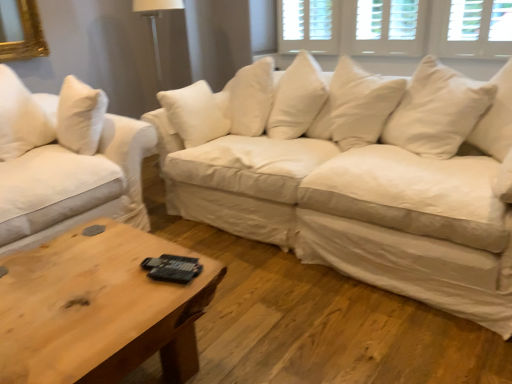
Question: Does white cotton couch at center, which is counted as the 1th studio couch, starting from the right, have a lesser height compared to white wood window at upper center, the second window when ordered from right to left?

Choices:
 (A) yes
 (B) no

Answer: (B)

Question: Is white cotton couch at center, which is counted as the 1th studio couch, starting from the right, outside white wood window at upper center, the second window when ordered from right to left?

Choices:
 (A) yes
 (B) no

Answer: (A)

Question: Is white cotton couch at center, the 2th studio couch when ordered from left to right, positioned with its back to white wood window at upper center, the first window from the left?

Choices:
 (A) yes
 (B) no

Answer: (B)

Question: From the image's perspective, is white cotton couch at center, which is counted as the 1th studio couch, starting from the right, under white wood window at upper center, the second window when ordered from right to left?

Choices:
 (A) yes
 (B) no

Answer: (A)

Question: Is the depth of white cotton couch at center, which is counted as the 1th studio couch, starting from the right, greater than that of white wood window at upper center, the first window from the left?

Choices:
 (A) yes
 (B) no

Answer: (B)

Question: Choose the correct answer: Is white wood blinds at upper center, the 1th window in the right-to-left sequence, inside white cotton couch at left, which is counted as the 2th studio couch, starting from the right, or outside it?

Choices:
 (A) outside
 (B) inside

Answer: (A)

Question: Considering the positions of white wood blinds at upper center, the 1th window in the right-to-left sequence, and white cotton couch at left, which is counted as the 2th studio couch, starting from the right, in the image, is white wood blinds at upper center, the 1th window in the right-to-left sequence, taller or shorter than white cotton couch at left, which is counted as the 2th studio couch, starting from the right,?

Choices:
 (A) tall
 (B) short

Answer: (B)

Question: Is white wood blinds at upper center, which ranks as the second window in left-to-right order, to the left or to the right of white cotton couch at left, the 1th studio couch in the left-to-right sequence, in the image?

Choices:
 (A) right
 (B) left

Answer: (A)

Question: From the image's perspective, relative to white cotton couch at left, which is counted as the 2th studio couch, starting from the right, is white wood blinds at upper center, which ranks as the second window in left-to-right order, above or below?

Choices:
 (A) below
 (B) above

Answer: (B)

Question: Do you think white cotton couch at left, which is counted as the 2th studio couch, starting from the right, is within white wood window at upper center, the first window from the left, or outside of it?

Choices:
 (A) inside
 (B) outside

Answer: (B)

Question: Considering the positions of white cotton couch at left, which is counted as the 2th studio couch, starting from the right, and white wood window at upper center, the second window when ordered from right to left, in the image, is white cotton couch at left, which is counted as the 2th studio couch, starting from the right, wider or thinner than white wood window at upper center, the second window when ordered from right to left,?

Choices:
 (A) thin
 (B) wide

Answer: (B)

Question: Based on their positions, is white cotton couch at left, which is counted as the 2th studio couch, starting from the right, located to the left or right of white wood window at upper center, the second window when ordered from right to left?

Choices:
 (A) left
 (B) right

Answer: (A)

Question: From their relative heights in the image, would you say white cotton couch at left, which is counted as the 2th studio couch, starting from the right, is taller or shorter than white wood window at upper center, the second window when ordered from right to left?

Choices:
 (A) tall
 (B) short

Answer: (A)

Question: From a real-world perspective, is white cotton couch at left, which is counted as the 2th studio couch, starting from the right, physically located above or below wooden rustic coffee table at center?

Choices:
 (A) below
 (B) above

Answer: (B)

Question: Does point (111, 132) appear closer or farther from the camera than point (130, 297)?

Choices:
 (A) closer
 (B) farther

Answer: (B)